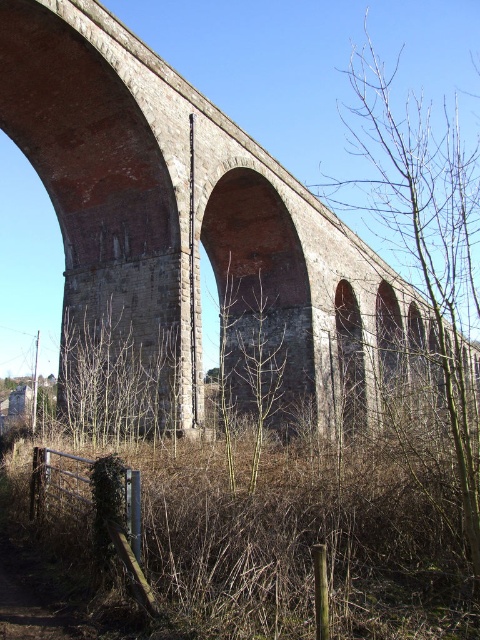
Which is more to the right, red brick arch at center or bare branches at right?

bare branches at right

Can you confirm if red brick arch at center is bigger than bare branches at right?

Actually, red brick arch at center might be smaller than bare branches at right.

Is point (49, 108) farther from viewer compared to point (470, 225)?

No, it is in front of (470, 225).

This screenshot has width=480, height=640. I want to click on red brick arch at center, so click(x=184, y=221).